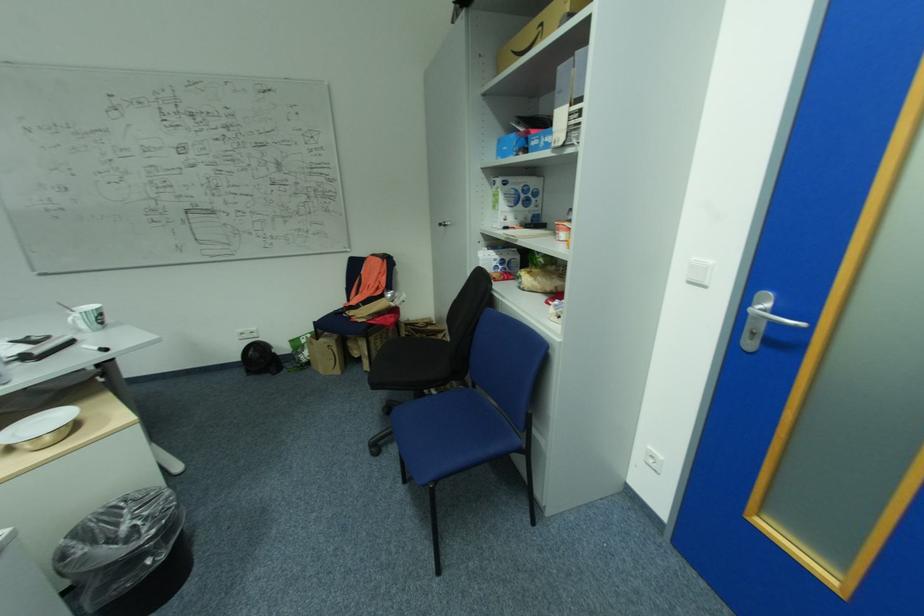
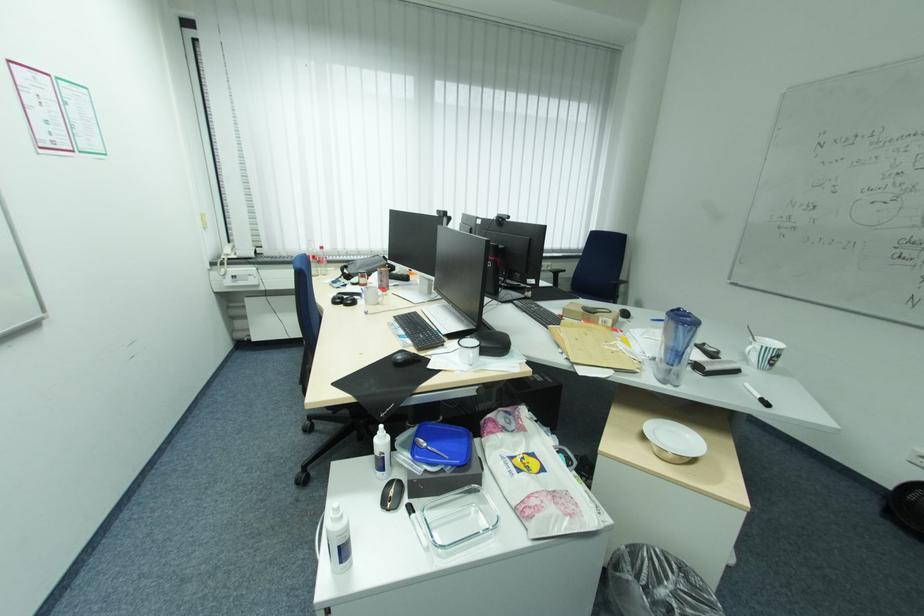
Find the pixel in the second image that matches (x=105, y=352) in the first image.

(763, 400)